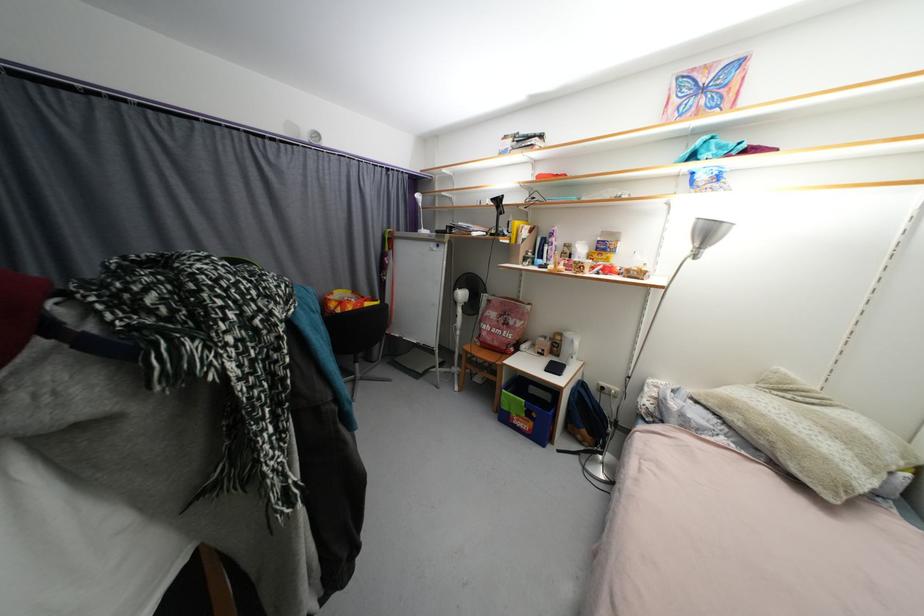
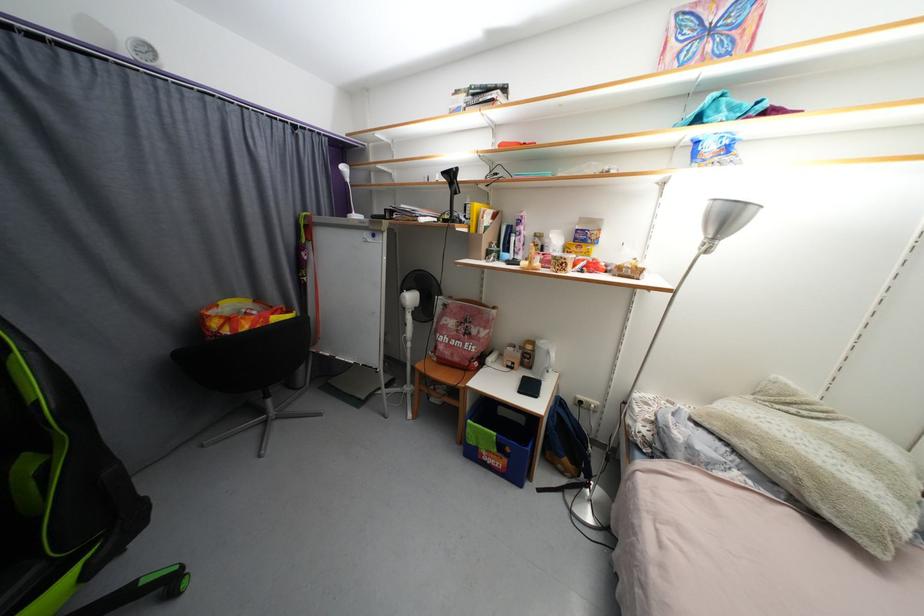
Find the pixel in the second image that matches pixel 430 233 in the first image.

(360, 217)